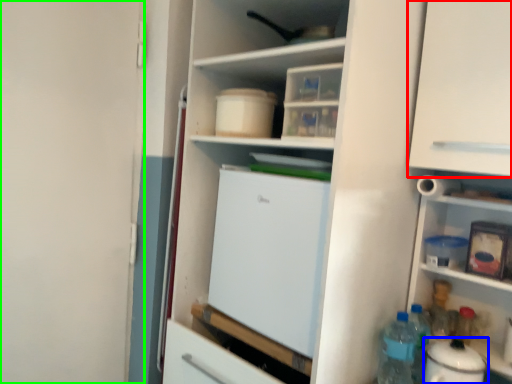
Question: Based on their relative distances, which object is nearer to cabinetry (highlighted by a red box)? Choose from appliance (highlighted by a blue box) and screen door (highlighted by a green box).

Choices:
 (A) appliance
 (B) screen door

Answer: (A)